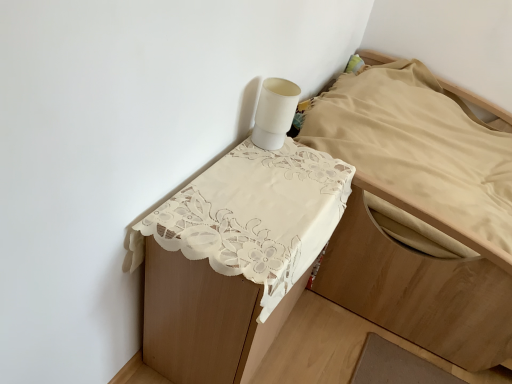
Question: From the image's perspective, is white lace tablecloth at upper center positioned above or below white lace tablecloth at upper center?

Choices:
 (A) above
 (B) below

Answer: (B)

Question: Is point (280, 296) closer or farther from the camera than point (437, 274)?

Choices:
 (A) farther
 (B) closer

Answer: (B)

Question: In the image, is white lace tablecloth at upper center on the left side or the right side of white lace tablecloth at upper center?

Choices:
 (A) left
 (B) right

Answer: (A)

Question: From the image's perspective, is white lace tablecloth at upper center above or below white lace tablecloth at upper center?

Choices:
 (A) below
 (B) above

Answer: (B)

Question: In terms of size, does white lace tablecloth at upper center appear bigger or smaller than white lace tablecloth at upper center?

Choices:
 (A) big
 (B) small

Answer: (A)

Question: Which is correct: white lace tablecloth at upper center is inside white lace tablecloth at upper center, or outside of it?

Choices:
 (A) outside
 (B) inside

Answer: (A)

Question: From a real-world perspective, is white lace tablecloth at upper center positioned above or below white lace tablecloth at upper center?

Choices:
 (A) below
 (B) above

Answer: (B)